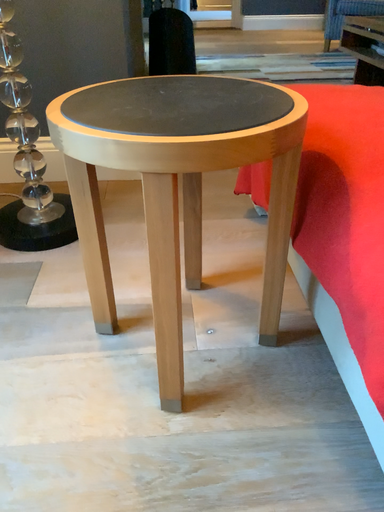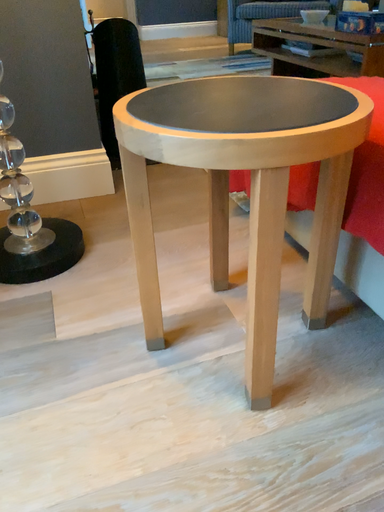
Question: Which way did the camera rotate in the video?

Choices:
 (A) rotated left
 (B) rotated right

Answer: (B)